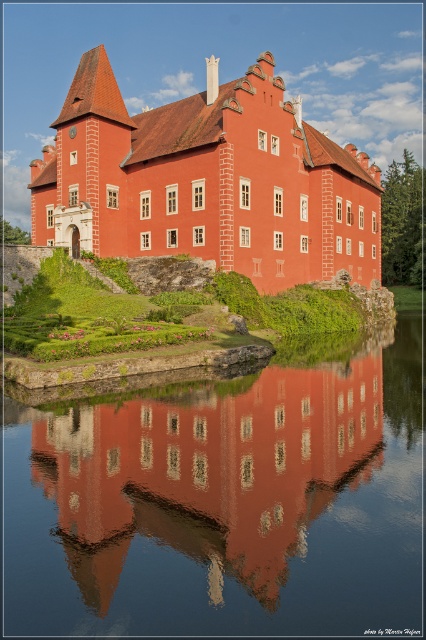
Question: Which point appears farthest from the camera in this image?

Choices:
 (A) (239, 218)
 (B) (373, 602)

Answer: (A)

Question: Which point is farther to the camera?

Choices:
 (A) (146, 506)
 (B) (275, 186)

Answer: (B)

Question: Is smooth glass water at center wider than matte red stone castle at center?

Choices:
 (A) yes
 (B) no

Answer: (B)

Question: Is smooth glass water at center below matte red stone castle at center?

Choices:
 (A) yes
 (B) no

Answer: (A)

Question: Can you confirm if smooth glass water at center is positioned below matte red stone castle at center?

Choices:
 (A) no
 (B) yes

Answer: (B)